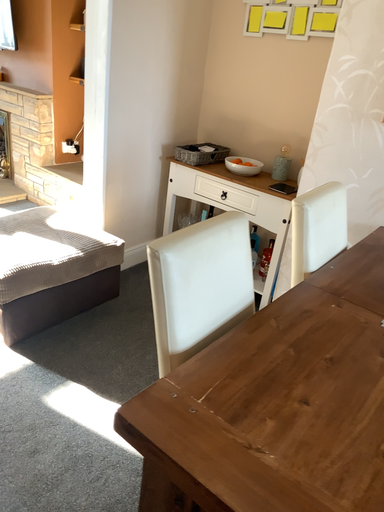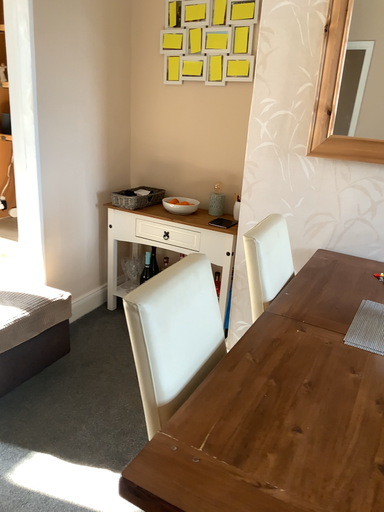
Question: Which way did the camera rotate in the video?

Choices:
 (A) rotated right
 (B) rotated left

Answer: (A)